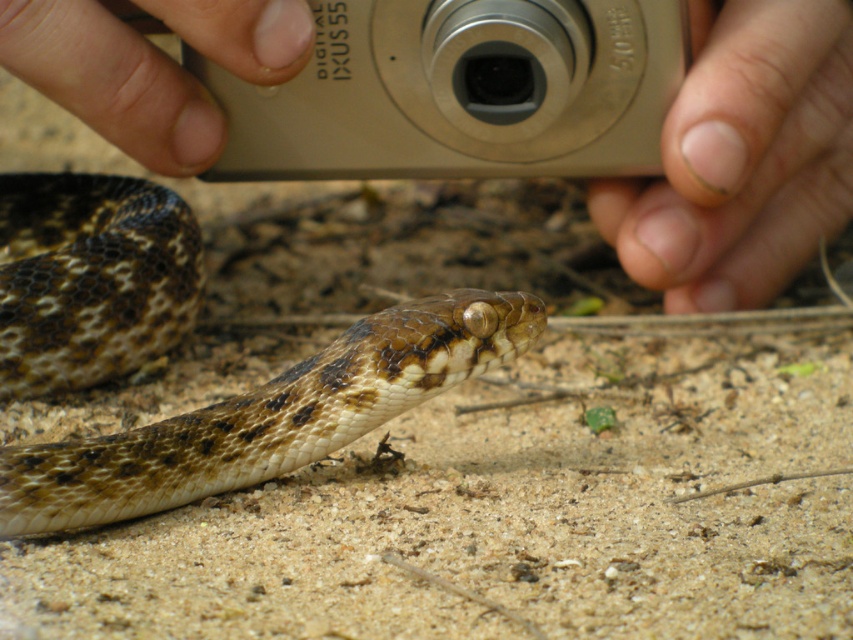
Does silver metallic camera at upper center have a smaller size compared to nail polish on fingernail at upper right?

Indeed, silver metallic camera at upper center has a smaller size compared to nail polish on fingernail at upper right.

Is silver metallic camera at upper center bigger than nail polish on fingernail at upper right?

Actually, silver metallic camera at upper center might be smaller than nail polish on fingernail at upper right.

The image size is (853, 640). I want to click on silver metallic camera at upper center, so click(x=460, y=92).

Who is taller, brown scaly snake at center or flesh-toned skin at upper left?

brown scaly snake at center is taller.

Measure the distance between point (x=28, y=236) and camera.

Point (x=28, y=236) and camera are 4.85 feet apart.

Identify the location of brown scaly snake at center. (268, 417).

Does brown scaly snake at center have a smaller size compared to silver metallic camera at upper center?

Yes.

The width and height of the screenshot is (853, 640). What do you see at coordinates (268, 417) in the screenshot?
I see `brown scaly snake at center` at bounding box center [268, 417].

Where is `brown scaly snake at center`? brown scaly snake at center is located at coordinates 268,417.